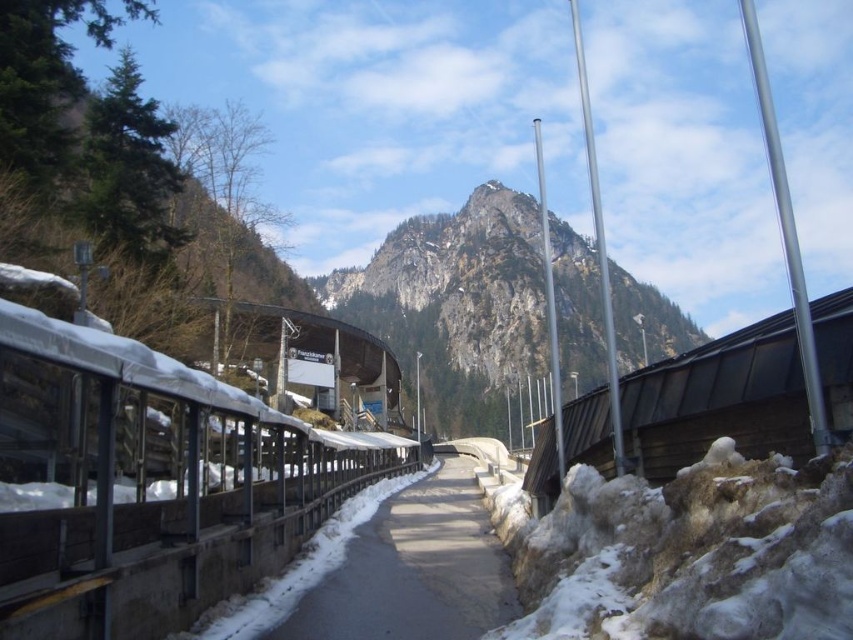
You are standing at point (413, 570) in the snowy landscape. What type of surface are you currently on?

You are standing on the smooth asphalt path at center located at point (413, 570).

You are planning to take a photo of the rugged stone mountain at center and the smooth asphalt path at center. Which object will occupy more space in your photo?

The rugged stone mountain at center will occupy more space in the photo because it has a larger size compared to the smooth asphalt path at center.